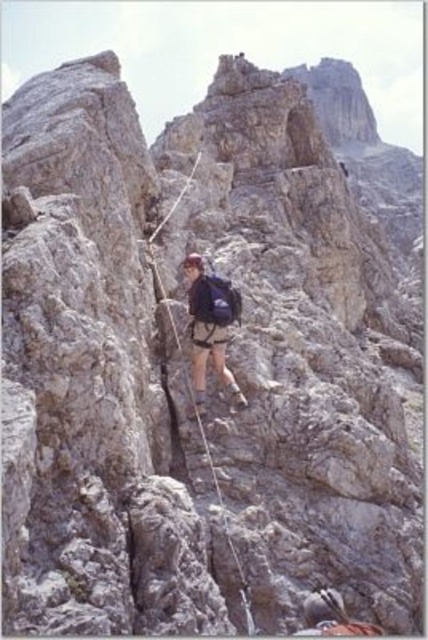
You are a climber who needs to retrieve your matte blue backpack at center from the rock face. Based on its coordinates, can you estimate its position relative to the center of the rock face?

The matte blue backpack at center is located exactly at the center of the rock face since its coordinates are at point (211,324), which is very close to the center point of the image.

You are a safety inspector checking the climbing gear setup. You notice the matte blue backpack at center and the black nylon rope at center. According to safety protocols, the backpack should be positioned below the rope to avoid snagging. Is the current arrangement compliant with safety standards?

The matte blue backpack at center is above the black nylon rope at center, which violates safety protocols as the backpack should be positioned below the rope to prevent snagging. The current arrangement is not compliant with safety standards.